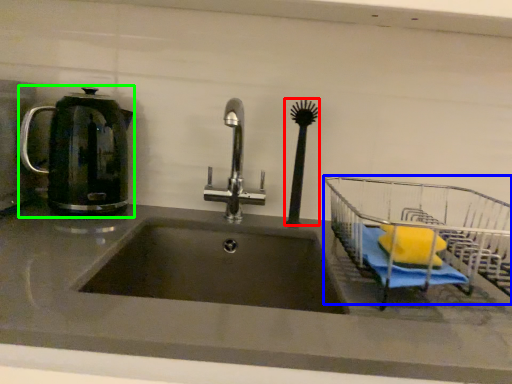
Question: Considering the real-world distances, which object is farthest from brush (highlighted by a red box)? cart (highlighted by a blue box) or kettle (highlighted by a green box)?

Choices:
 (A) cart
 (B) kettle

Answer: (B)